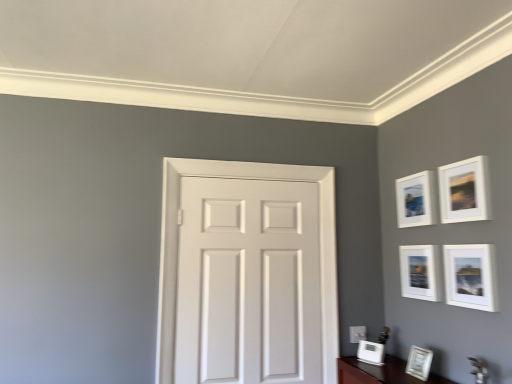
Question: Is white glossy picture frame at lower right, the fifth picture frame in the top-to-bottom sequence, positioned with its back to white matte door at center?

Choices:
 (A) no
 (B) yes

Answer: (A)

Question: From the image's perspective, is white glossy picture frame at lower right, the fifth picture frame in the top-to-bottom sequence, on white matte door at center?

Choices:
 (A) yes
 (B) no

Answer: (B)

Question: From a real-world perspective, is white glossy picture frame at lower right, the fifth picture frame in the top-to-bottom sequence, located higher than white matte door at center?

Choices:
 (A) no
 (B) yes

Answer: (A)

Question: Can you confirm if white glossy picture frame at lower right, the fifth picture frame in the top-to-bottom sequence, is positioned to the right of white matte door at center?

Choices:
 (A) no
 (B) yes

Answer: (B)

Question: Considering the relative sizes of white glossy picture frame at lower right, which is the second picture frame in bottom-to-top order, and white matte door at center in the image provided, is white glossy picture frame at lower right, which is the second picture frame in bottom-to-top order, smaller than white matte door at center?

Choices:
 (A) yes
 (B) no

Answer: (A)

Question: Considering the positions of white matte picture frame at upper right, the 3th picture frame positioned from the top, and white matte door at center in the image, is white matte picture frame at upper right, the 3th picture frame positioned from the top, wider or thinner than white matte door at center?

Choices:
 (A) wide
 (B) thin

Answer: (A)

Question: From a real-world perspective, is white matte picture frame at upper right, the fourth picture frame in the bottom-to-top sequence, above or below white matte door at center?

Choices:
 (A) above
 (B) below

Answer: (A)

Question: In terms of height, does white matte picture frame at upper right, the 3th picture frame positioned from the top, look taller or shorter compared to white matte door at center?

Choices:
 (A) short
 (B) tall

Answer: (A)

Question: Would you say white matte picture frame at upper right, the fourth picture frame in the bottom-to-top sequence, is inside or outside white matte door at center?

Choices:
 (A) inside
 (B) outside

Answer: (B)

Question: Considering the relative positions of white matte picture frame at upper right, the 4th picture frame in the top-to-bottom sequence, and white matte door at center in the image provided, is white matte picture frame at upper right, the 4th picture frame in the top-to-bottom sequence, to the left or to the right of white matte door at center?

Choices:
 (A) right
 (B) left

Answer: (A)

Question: From the image's perspective, relative to white matte door at center, is white matte picture frame at upper right, the 4th picture frame in the top-to-bottom sequence, above or below?

Choices:
 (A) below
 (B) above

Answer: (B)

Question: In terms of size, does white matte picture frame at upper right, which is counted as the 3th picture frame, starting from the bottom, appear bigger or smaller than white matte door at center?

Choices:
 (A) big
 (B) small

Answer: (B)

Question: In the image, is white matte picture frame at upper right, which is counted as the 3th picture frame, starting from the bottom, positioned in front of or behind white matte door at center?

Choices:
 (A) behind
 (B) front

Answer: (B)

Question: From a real-world perspective, is white matte picture frame at upper right, the fourth picture frame in the bottom-to-top sequence, above or below white glossy picture frame at lower right, the sixth picture frame when ordered from top to bottom?

Choices:
 (A) above
 (B) below

Answer: (A)

Question: From the image's perspective, is white matte picture frame at upper right, the fourth picture frame in the bottom-to-top sequence, above or below white glossy picture frame at lower right, the sixth picture frame when ordered from top to bottom?

Choices:
 (A) above
 (B) below

Answer: (A)